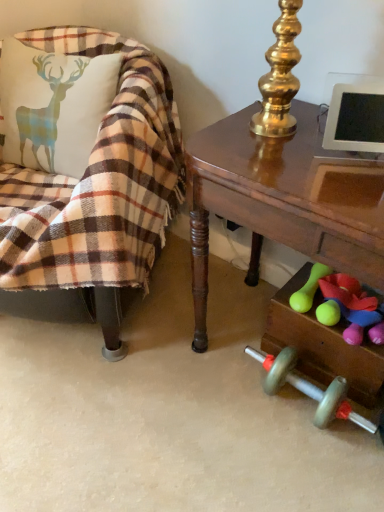
Question: Considering the relative sizes of rubberized green dumbbell at lower right, acting as the first toy starting from the right, and plaid fabric chair at left in the image provided, is rubberized green dumbbell at lower right, acting as the first toy starting from the right, wider than plaid fabric chair at left?

Choices:
 (A) no
 (B) yes

Answer: (A)

Question: Is rubberized green dumbbell at lower right, which is the second toy in left-to-right order, next to plaid fabric chair at left and touching it?

Choices:
 (A) no
 (B) yes

Answer: (A)

Question: Is rubberized green dumbbell at lower right, which is the second toy in left-to-right order, at the left side of plaid fabric chair at left?

Choices:
 (A) yes
 (B) no

Answer: (B)

Question: From a real-world perspective, is rubberized green dumbbell at lower right, which is the second toy in left-to-right order, over plaid fabric chair at left?

Choices:
 (A) yes
 (B) no

Answer: (B)

Question: Is rubberized green dumbbell at lower right, which is the second toy in left-to-right order, at the right side of plaid fabric chair at left?

Choices:
 (A) no
 (B) yes

Answer: (B)

Question: From the image's perspective, relative to rubberized green dumbbell at lower right, which is the second toy in left-to-right order, is shiny brown desk at right above or below?

Choices:
 (A) above
 (B) below

Answer: (A)

Question: From a real-world perspective, is shiny brown desk at right positioned above or below rubberized green dumbbell at lower right, acting as the first toy starting from the right?

Choices:
 (A) above
 (B) below

Answer: (A)

Question: Do you think shiny brown desk at right is within rubberized green dumbbell at lower right, which is the second toy in left-to-right order, or outside of it?

Choices:
 (A) inside
 (B) outside

Answer: (B)

Question: Considering the positions of point (274, 159) and point (332, 295), is point (274, 159) closer or farther from the camera than point (332, 295)?

Choices:
 (A) closer
 (B) farther

Answer: (A)

Question: Is black glossy tablet at upper right taller or shorter than plaid fabric chair at left?

Choices:
 (A) short
 (B) tall

Answer: (A)

Question: Is point (354, 86) closer or farther from the camera than point (180, 175)?

Choices:
 (A) farther
 (B) closer

Answer: (B)

Question: In terms of width, does black glossy tablet at upper right look wider or thinner when compared to plaid fabric chair at left?

Choices:
 (A) thin
 (B) wide

Answer: (A)

Question: From the image's perspective, relative to plaid fabric chair at left, is black glossy tablet at upper right above or below?

Choices:
 (A) above
 (B) below

Answer: (A)

Question: Is plaid fabric chair at left to the left or to the right of black glossy tablet at upper right in the image?

Choices:
 (A) left
 (B) right

Answer: (A)

Question: Based on their sizes in the image, would you say plaid fabric chair at left is bigger or smaller than black glossy tablet at upper right?

Choices:
 (A) big
 (B) small

Answer: (A)